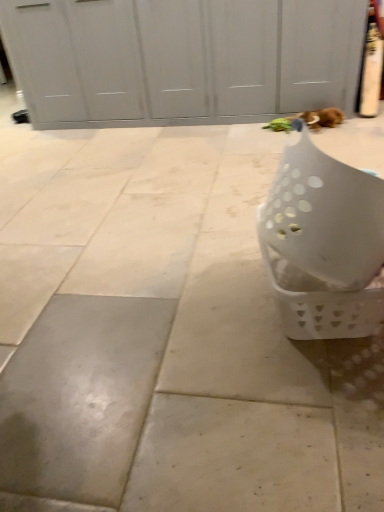
Question: Is brown plush cat at upper right facing away from white plastic basket at lower right?

Choices:
 (A) no
 (B) yes

Answer: (A)

Question: Could you tell me if brown plush cat at upper right is turned towards white plastic basket at lower right?

Choices:
 (A) no
 (B) yes

Answer: (B)

Question: Considering the relative sizes of brown plush cat at upper right and white plastic basket at lower right in the image provided, is brown plush cat at upper right smaller than white plastic basket at lower right?

Choices:
 (A) yes
 (B) no

Answer: (A)

Question: Considering the relative positions of brown plush cat at upper right and white plastic basket at lower right in the image provided, is brown plush cat at upper right behind white plastic basket at lower right?

Choices:
 (A) no
 (B) yes

Answer: (B)

Question: From the image's perspective, is brown plush cat at upper right located beneath white plastic basket at lower right?

Choices:
 (A) no
 (B) yes

Answer: (A)

Question: From a real-world perspective, is brown plush cat at upper right positioned under white plastic basket at lower right based on gravity?

Choices:
 (A) no
 (B) yes

Answer: (B)

Question: Is white plastic basket at lower right outside of brown plush cat at upper right?

Choices:
 (A) no
 (B) yes

Answer: (B)

Question: Considering the relative sizes of white plastic basket at lower right and brown plush cat at upper right in the image provided, is white plastic basket at lower right thinner than brown plush cat at upper right?

Choices:
 (A) no
 (B) yes

Answer: (A)

Question: Can you confirm if white plastic basket at lower right is shorter than brown plush cat at upper right?

Choices:
 (A) yes
 (B) no

Answer: (B)

Question: Does white plastic basket at lower right have a larger size compared to brown plush cat at upper right?

Choices:
 (A) no
 (B) yes

Answer: (B)

Question: From the image's perspective, is white plastic basket at lower right beneath brown plush cat at upper right?

Choices:
 (A) no
 (B) yes

Answer: (B)

Question: From a real-world perspective, does white plastic basket at lower right stand above brown plush cat at upper right?

Choices:
 (A) no
 (B) yes

Answer: (B)

Question: From the image's perspective, is brown plush cat at upper right located above or below white plastic basket at lower right?

Choices:
 (A) above
 (B) below

Answer: (A)